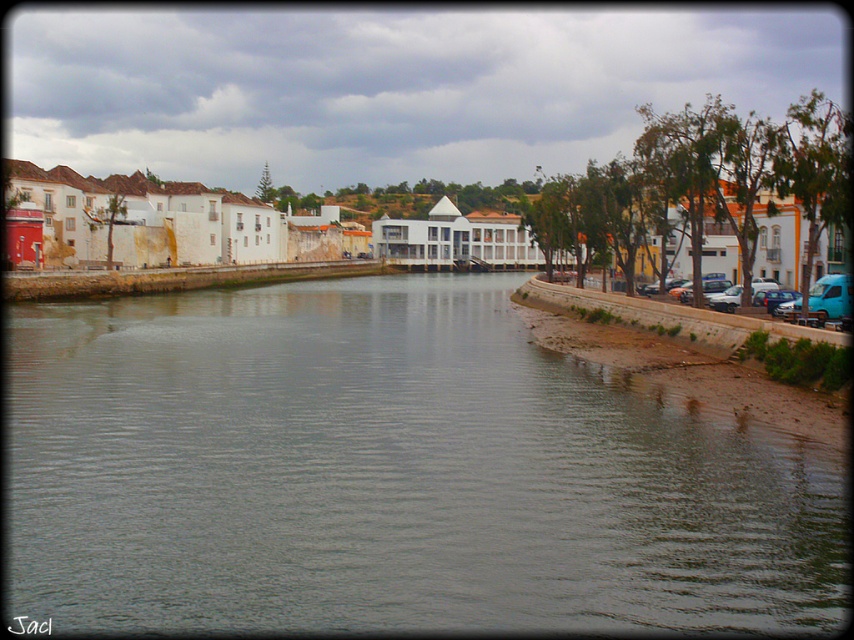
Question: Does green water at center appear under brown stone embankment at right?

Choices:
 (A) no
 (B) yes

Answer: (B)

Question: Can you confirm if green water at center is positioned to the left of brown stone embankment at right?

Choices:
 (A) no
 (B) yes

Answer: (B)

Question: Is green water at center to the right of brown stone embankment at right from the viewer's perspective?

Choices:
 (A) no
 (B) yes

Answer: (A)